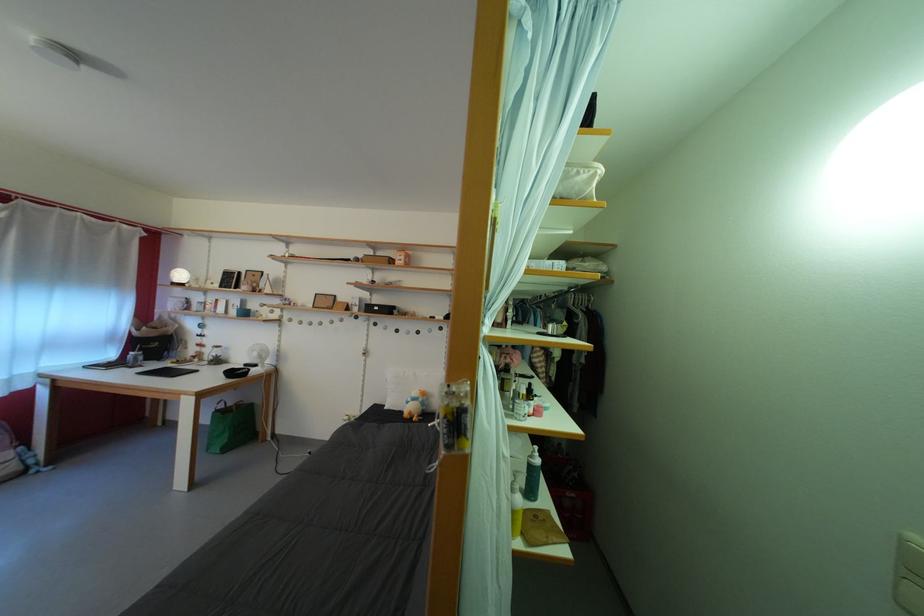
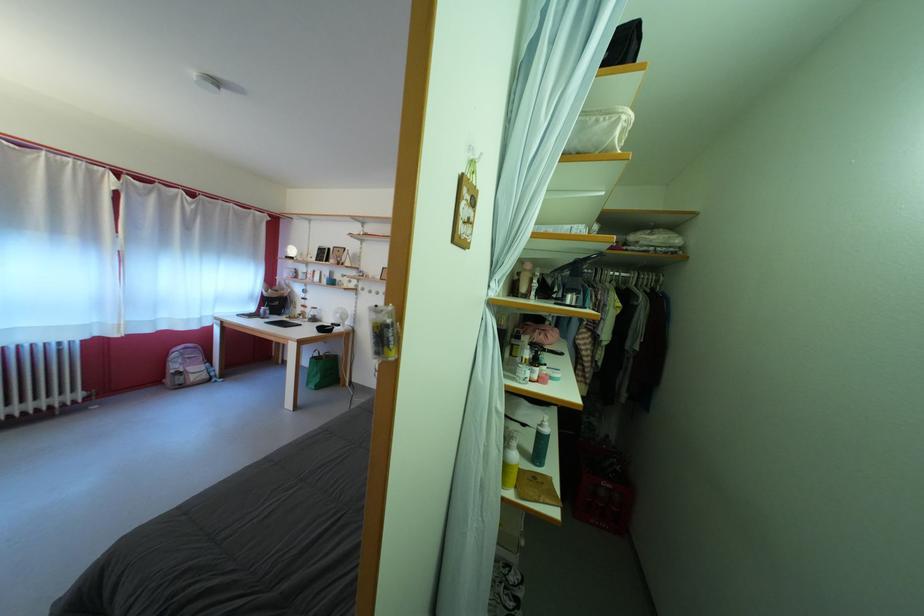
In the second image, find the point that corresponds to (540,463) in the first image.

(549, 431)